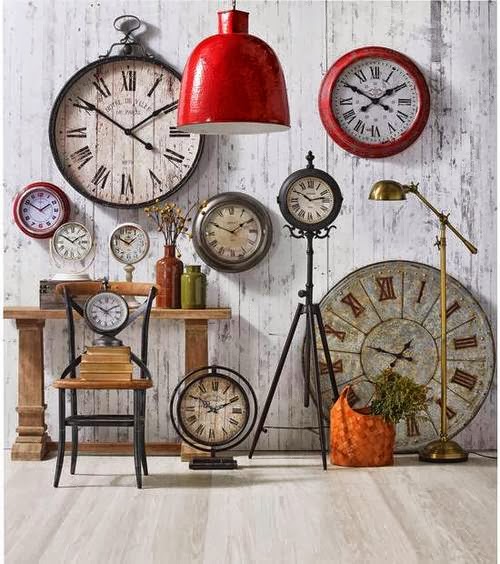
In order to click on clock in this screenshot , I will do `click(103, 311)`, `click(129, 237)`, `click(64, 239)`, `click(39, 220)`, `click(126, 143)`, `click(371, 96)`, `click(313, 199)`, `click(224, 233)`, `click(215, 404)`, `click(405, 350)`.